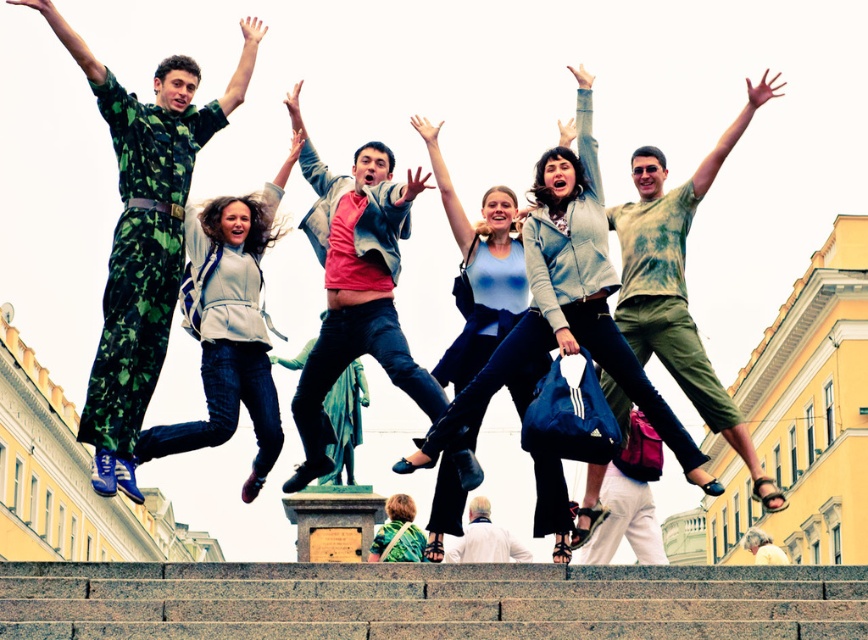
Question: Can you confirm if denim jacket at center is thinner than light green tie-dye shirt at center?

Choices:
 (A) no
 (B) yes

Answer: (B)

Question: Estimate the real-world distances between objects in this image. Which object is farther from the denim jacket at center?

Choices:
 (A) white leather jacket at center
 (B) light green tie-dye shirt at center
 (C) green camouflage jumpsuit at center
 (D) camouflage jumpsuit at left

Answer: (A)

Question: Based on their relative distances, which object is nearer to the granite stairs at lower center?

Choices:
 (A) camouflage jumpsuit at left
 (B) white fabric shirt at center

Answer: (A)

Question: Which point is closer to the camera?

Choices:
 (A) light green tie-dye shirt at center
 (B) white leather jacket at center
 (C) granite stairs at lower center

Answer: (C)

Question: From the image, what is the correct spatial relationship of camouflage pants at left in relation to white fabric shirt at center?

Choices:
 (A) above
 (B) below

Answer: (A)

Question: Can you confirm if denim jacket at center is bigger than white leather jacket at center?

Choices:
 (A) yes
 (B) no

Answer: (A)